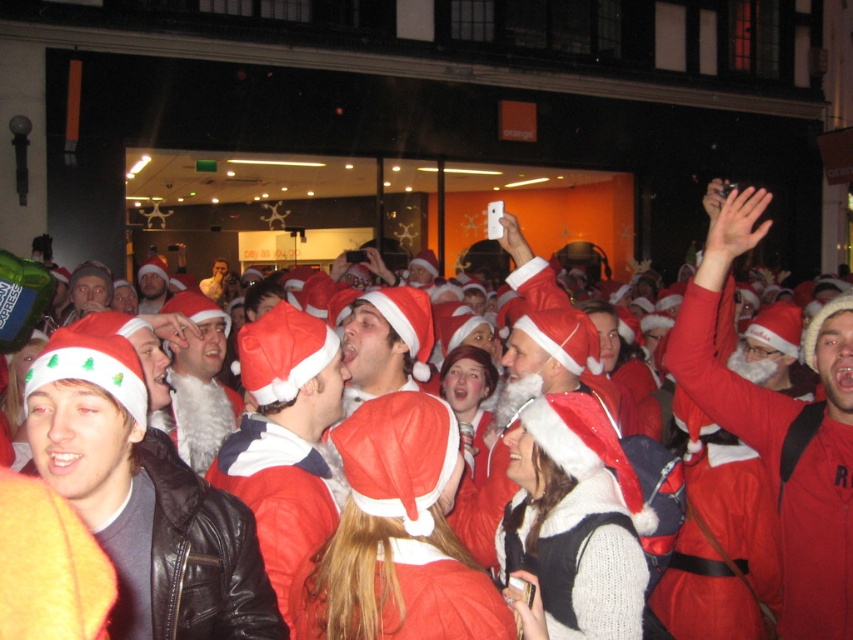
You are standing in the crowd at the Christmas event and want to take a photo of the storefront in the background. You have a camera that can focus up to 5 meters away. Is the point at coordinates point (x=100, y=474) within the camera focus range?

The distance of point (x=100, y=474) from the camera is 4.13 meters, so yes, the point is within the camera focus range since 4.13 meters is less than 5 meters.

You are standing in the crowd and want to take a photo of the matte black jacket at center and the white fluffy santa hat at center. Which one is closer to the camera?

The matte black jacket at center is below the white fluffy santa hat at center, so the white fluffy santa hat at center is closer to the camera.

You are standing at the center of the crowd in the festive scene. You need to locate the matte black jacket at center. Based on its coordinates, which direction should you look to find it?

The matte black jacket at center is located at coordinates point (144, 499), so you should look downward since the y coordinate 0.170 is below the center point of the image.